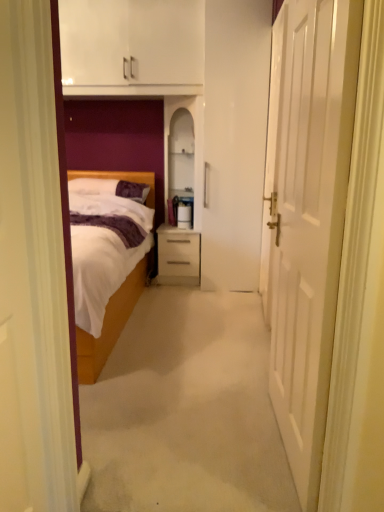
Question: From a real-world perspective, is wooden bed at left on matte white drawer at center?

Choices:
 (A) no
 (B) yes

Answer: (B)

Question: Is wooden bed at left at the right side of matte white drawer at center?

Choices:
 (A) no
 (B) yes

Answer: (A)

Question: Is wooden bed at left not near matte white drawer at center?

Choices:
 (A) no
 (B) yes

Answer: (A)

Question: Does wooden bed at left have a smaller size compared to matte white drawer at center?

Choices:
 (A) no
 (B) yes

Answer: (A)

Question: Is wooden bed at left directly adjacent to matte white drawer at center?

Choices:
 (A) no
 (B) yes

Answer: (A)

Question: Does wooden bed at left lie behind matte white drawer at center?

Choices:
 (A) yes
 (B) no

Answer: (B)

Question: Is matte white drawer at center at the back of white soft pillow at center?

Choices:
 (A) yes
 (B) no

Answer: (B)

Question: From a real-world perspective, does white soft pillow at center stand above matte white drawer at center?

Choices:
 (A) yes
 (B) no

Answer: (A)

Question: Can you confirm if white soft pillow at center is shorter than matte white drawer at center?

Choices:
 (A) yes
 (B) no

Answer: (A)

Question: Does white soft pillow at center have a larger size compared to matte white drawer at center?

Choices:
 (A) yes
 (B) no

Answer: (B)

Question: Is white soft pillow at center further to camera compared to matte white drawer at center?

Choices:
 (A) yes
 (B) no

Answer: (B)

Question: From a real-world perspective, is white soft pillow at center physically below matte white drawer at center?

Choices:
 (A) yes
 (B) no

Answer: (B)

Question: Does wooden bed at left come behind white matte door at right?

Choices:
 (A) no
 (B) yes

Answer: (B)